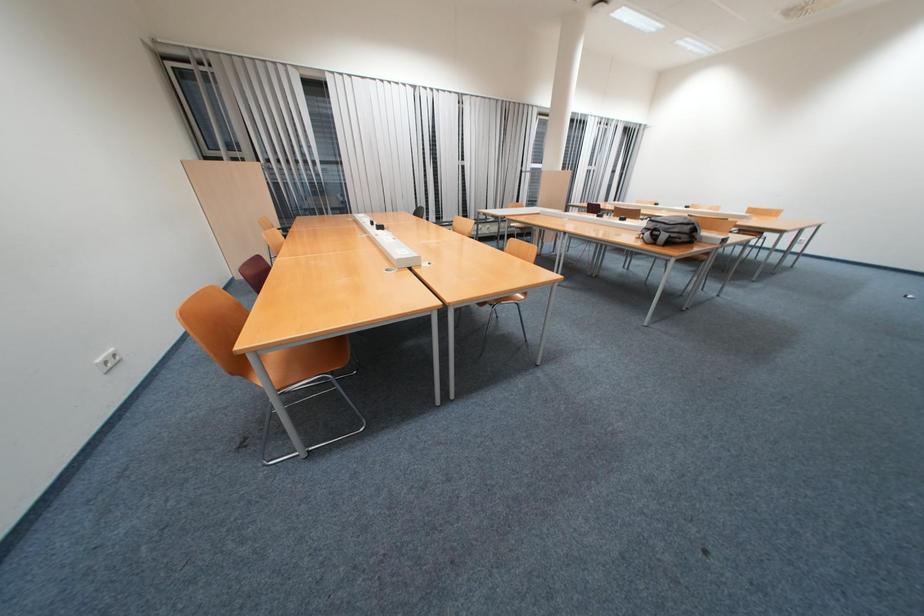
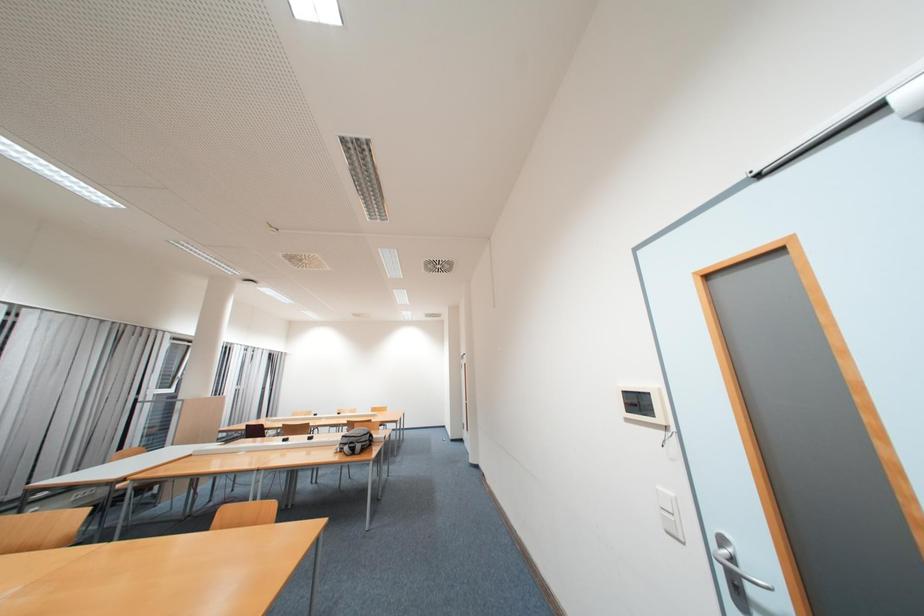
The first image is from the beginning of the video and the second image is from the end. How did the camera likely rotate when shooting the video?

The camera's rotation is toward right-up.